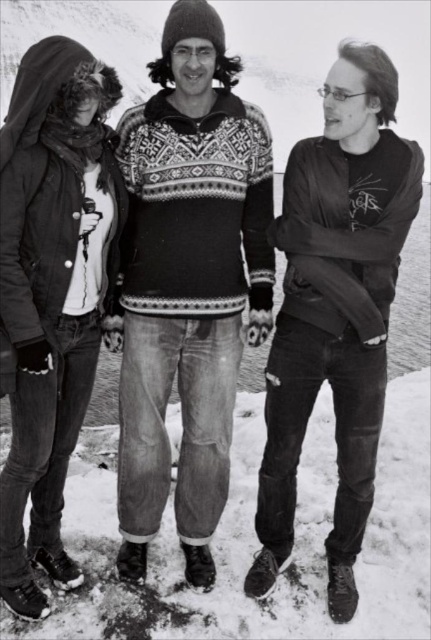
Question: Does denim jacket at left appear over brushed metal jacket at left?

Choices:
 (A) no
 (B) yes

Answer: (B)

Question: Considering the real-world distances, which object is farthest from the denim jacket at left?

Choices:
 (A) matte black jacket at center
 (B) brushed metal jacket at left

Answer: (A)

Question: Estimate the real-world distances between objects in this image. Which object is closer to the matte black jacket at center?

Choices:
 (A) brushed metal jacket at left
 (B) denim jacket at left

Answer: (B)

Question: Among these objects, which one is farthest from the camera?

Choices:
 (A) denim jacket at left
 (B) brushed metal jacket at left

Answer: (A)

Question: Does denim jacket at left appear over brushed metal jacket at left?

Choices:
 (A) yes
 (B) no

Answer: (A)

Question: Is denim jacket at left positioned before matte black jacket at center?

Choices:
 (A) yes
 (B) no

Answer: (B)